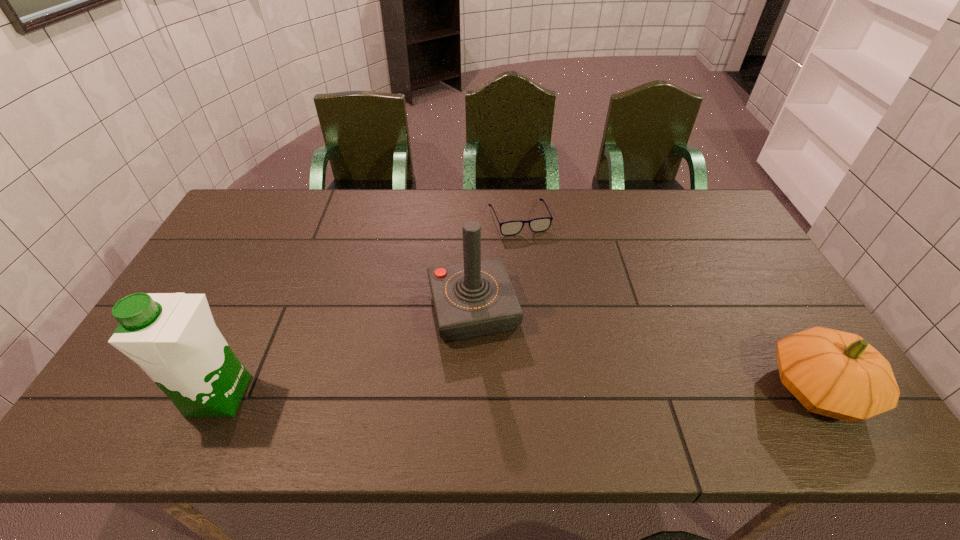
What are the coordinates of `vacant space at the far right corner of the desktop` in the screenshot? It's located at (704, 195).

You are a GUI agent. You are given a task and a screenshot of the screen. Output one action in this format:
    pyautogui.click(x=<x>, y=<y>)
    Task: Click on the free space between the leftmost object and the rightmost object
    
    Given the screenshot: What is the action you would take?
    pyautogui.click(x=518, y=392)

Identify the location of vacant space that's between the third nearest object and the soya milk. (347, 353).

Locate an element on the screen. The width and height of the screenshot is (960, 540). free space between the joystick and the soya milk is located at coordinates (347, 353).

Find the location of `vacant area that lies between the leftmost object and the farthest object`. vacant area that lies between the leftmost object and the farthest object is located at coordinates coord(370,307).

The height and width of the screenshot is (540, 960). What are the coordinates of `free space that is in between the rightmost object and the shortest object` in the screenshot? It's located at (668, 303).

This screenshot has width=960, height=540. Find the location of `free space between the gourd and the shortest object`. free space between the gourd and the shortest object is located at coordinates (668, 303).

Locate which object is the closest to the gourd. Please provide its 2D coordinates. Your answer should be formatted as a tuple, i.e. [(x, y)], where the tuple contains the x and y coordinates of a point satisfying the conditions above.

[(476, 298)]

Identify which object is located as the third nearest to the second farthest object. Please provide its 2D coordinates. Your answer should be formatted as a tuple, i.e. [(x, y)], where the tuple contains the x and y coordinates of a point satisfying the conditions above.

[(837, 374)]